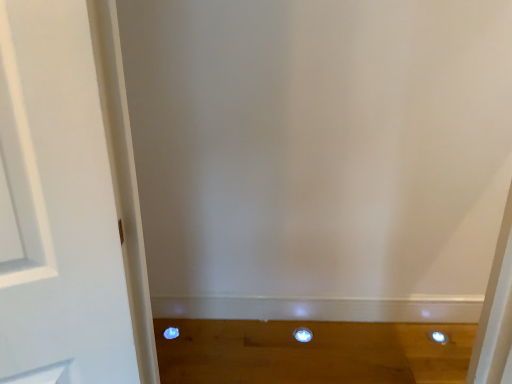
Question: From a real-world perspective, is white glossy dot at center, acting as the second dot starting from the left, above or below matte blue dot at lower left, positioned as the 1th dot in left-to-right order?

Choices:
 (A) below
 (B) above

Answer: (B)

Question: In the image, is white glossy dot at center, acting as the second dot starting from the left, on the left side or the right side of matte blue dot at lower left, positioned as the 1th dot in left-to-right order?

Choices:
 (A) left
 (B) right

Answer: (B)

Question: From the image's perspective, is white glossy dot at center, acting as the second dot starting from the left, positioned above or below matte blue dot at lower left, positioned as the 1th dot in left-to-right order?

Choices:
 (A) below
 (B) above

Answer: (A)

Question: From the image's perspective, relative to white glossy dot at center, which appears as the 1th dot when viewed from the right, is matte blue dot at lower left, positioned as the 1th dot in left-to-right order, above or below?

Choices:
 (A) below
 (B) above

Answer: (B)

Question: Is point (174, 329) positioned closer to the camera than point (298, 332)?

Choices:
 (A) farther
 (B) closer

Answer: (A)

Question: Considering the positions of matte blue dot at lower left, positioned as the 1th dot in left-to-right order, and white glossy dot at center, acting as the second dot starting from the left, in the image, is matte blue dot at lower left, positioned as the 1th dot in left-to-right order, taller or shorter than white glossy dot at center, acting as the second dot starting from the left,?

Choices:
 (A) short
 (B) tall

Answer: (A)

Question: Considering the positions of matte blue dot at lower left, positioned as the 1th dot in left-to-right order, and white glossy dot at center, acting as the second dot starting from the left, in the image, is matte blue dot at lower left, positioned as the 1th dot in left-to-right order, wider or thinner than white glossy dot at center, acting as the second dot starting from the left,?

Choices:
 (A) wide
 (B) thin

Answer: (B)